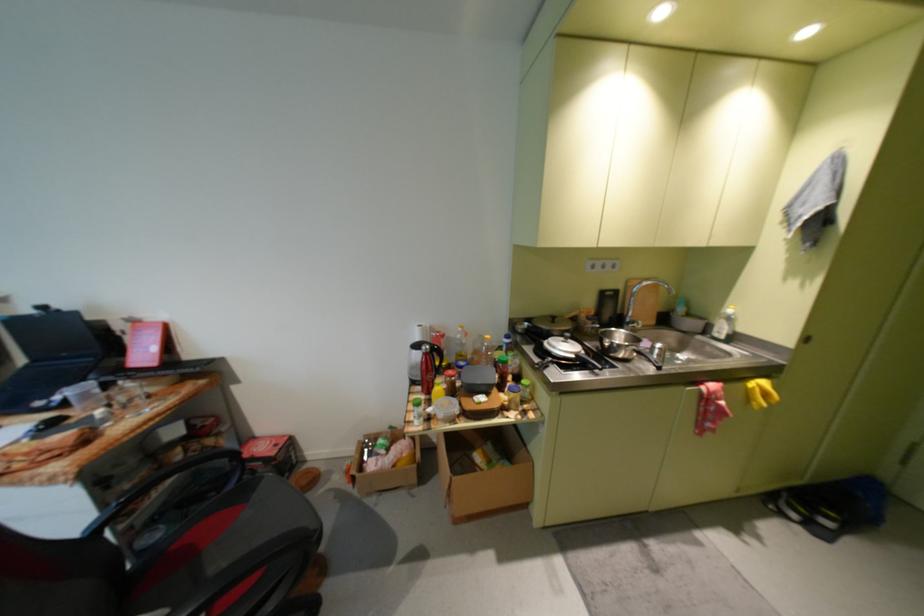
At what (x,y) coordinates should I click in order to perform the action: click on clear plastic bottle. Please return your answer as a coordinate pair (x, y). The image size is (924, 616). Looking at the image, I should click on (488, 351).